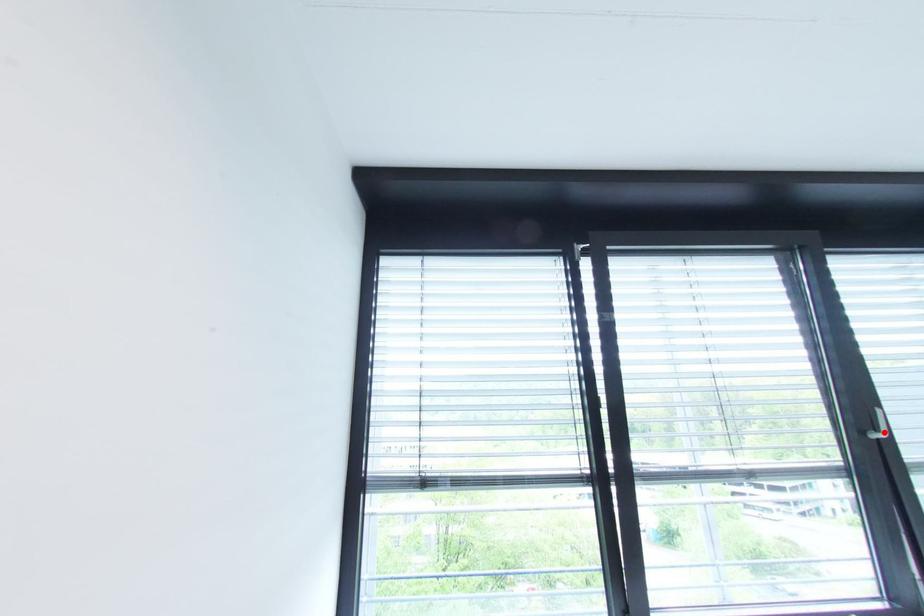
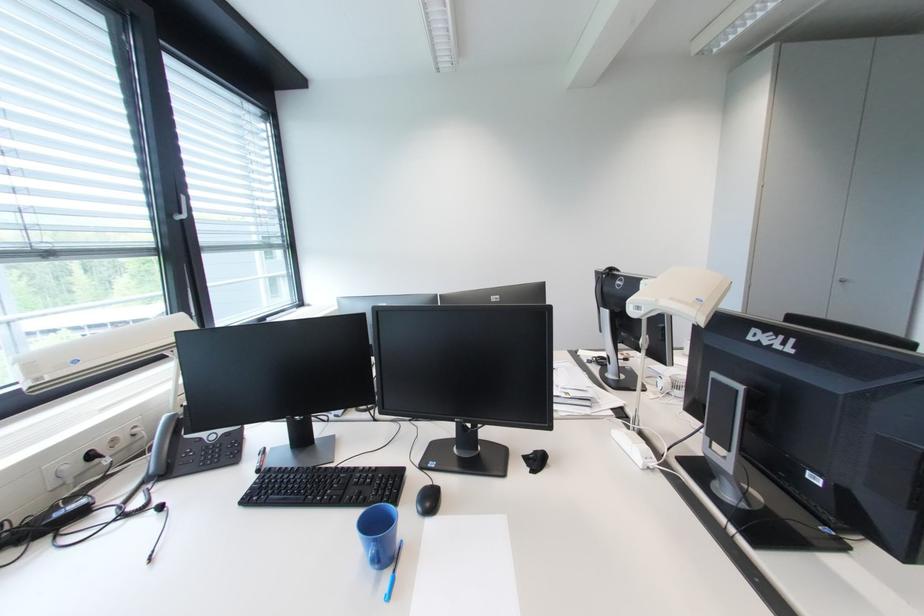
Question: I am providing you with two images of the same scene from different viewpoints. A red point is marked on the first image. Is the red point's position out of view in image 2?

Choices:
 (A) Yes
 (B) No

Answer: (B)